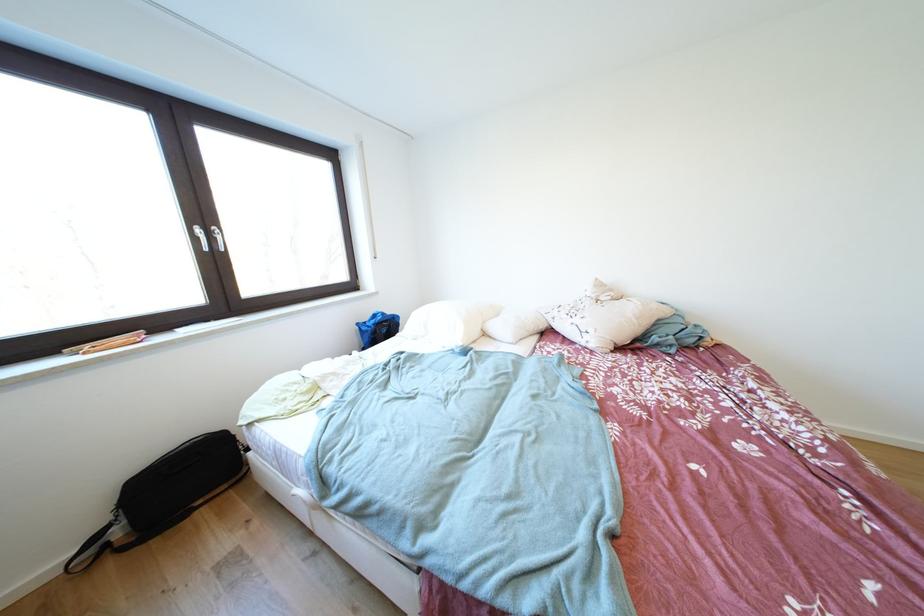
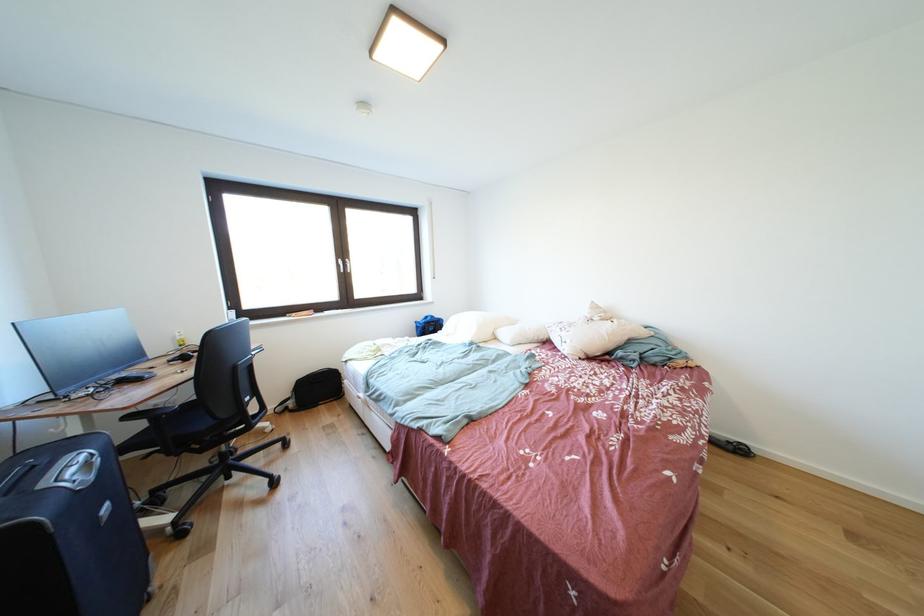
Find the pixel in the second image that matches the point at 585,325 in the first image.

(572, 338)